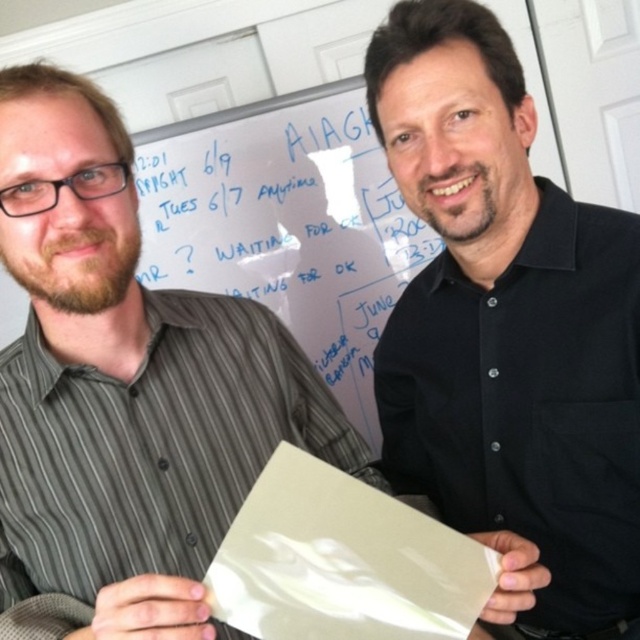
You are an office assistant who needs to place a 30 cm wide decorative item between the black matte paper at center and the white glossy paper at center. Is there enough space?

The black matte paper at center is 32.87 centimeters from the white glossy paper at center, so yes, there is enough space to place a 30 cm wide decorative item between them.

You are organizing a meeting and need to place a 10cm wide black matte paper at center and a white glossy paper at center on a desk. Given their positions, can both fit side by side without overlapping?

The black matte paper at center is to the right of white glossy paper at center, so they are already positioned next to each other. Since their placement is side by side, both can fit without overlapping as long as the desk has enough space for both papers.

You are an office assistant who needs to file two documents. The black matte paper at center and the white glossy paper at center are both on the desk. The filing cabinet has two drawers, one marked for taller documents and the other for shorter ones. Which drawer should each document go into?

The black matte paper at center is taller than the white glossy paper at center, so the black matte paper at center should go into the drawer for taller documents and the white glossy paper at center into the one for shorter ones.